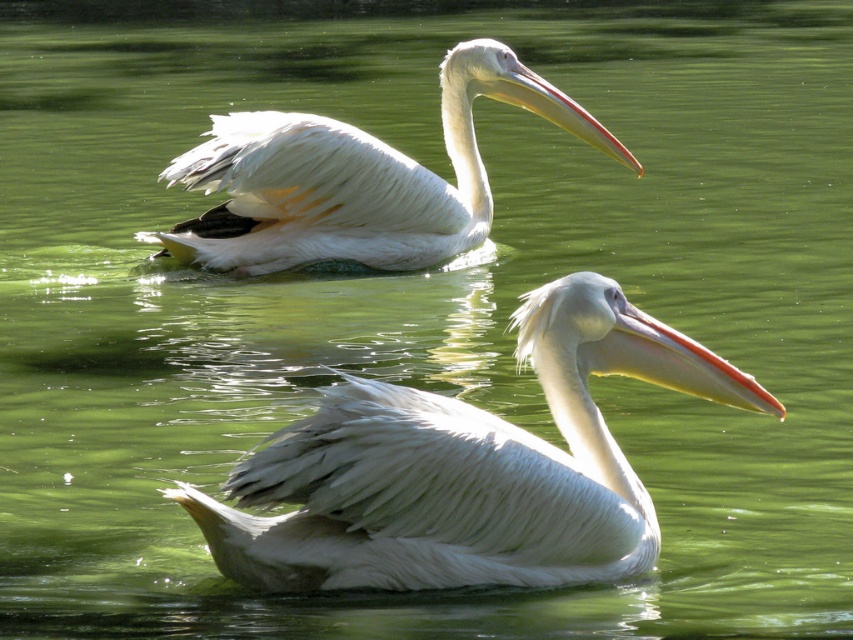
Which is behind, point (300, 204) or point (606, 150)?

The point (606, 150) is behind.

Is white feathered pelican at upper center below matte white beak at upper center?

Yes, white feathered pelican at upper center is below matte white beak at upper center.

Which is behind, point (413, 182) or point (560, 97)?

Positioned behind is point (413, 182).

Where is `white feathered pelican at upper center`? The height and width of the screenshot is (640, 853). white feathered pelican at upper center is located at coordinates (357, 179).

Can you confirm if white feathered pelican at center is bigger than matte white beak at upper center?

Indeed, white feathered pelican at center has a larger size compared to matte white beak at upper center.

Is white feathered pelican at center taller than matte white beak at upper center?

Correct, white feathered pelican at center is much taller as matte white beak at upper center.

Is point (432, 408) farther from viewer compared to point (558, 100)?

No.

This screenshot has width=853, height=640. I want to click on white feathered pelican at center, so click(x=467, y=468).

Does white feathered pelican at upper center have a smaller size compared to white matte beak at center?

No.

Based on the photo, is white feathered pelican at upper center further to the viewer compared to white matte beak at center?

That is True.

Measure the distance between white feathered pelican at upper center and camera.

The distance of white feathered pelican at upper center from camera is 29.17 feet.

This screenshot has width=853, height=640. What are the coordinates of `white feathered pelican at upper center` in the screenshot? It's located at (357, 179).